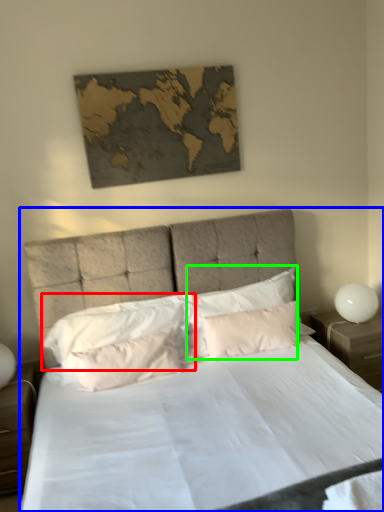
Question: Which object is the farthest from pillow (highlighted by a red box)? Choose among these: bed (highlighted by a blue box) or pillow (highlighted by a green box).

Choices:
 (A) bed
 (B) pillow

Answer: (B)